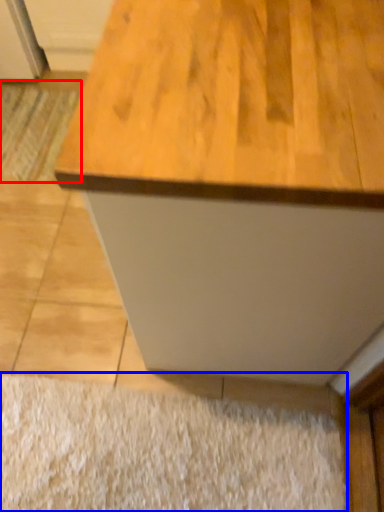
Question: Which object appears closest to the camera in this image, doormat (highlighted by a red box) or doormat (highlighted by a blue box)?

Choices:
 (A) doormat
 (B) doormat

Answer: (B)